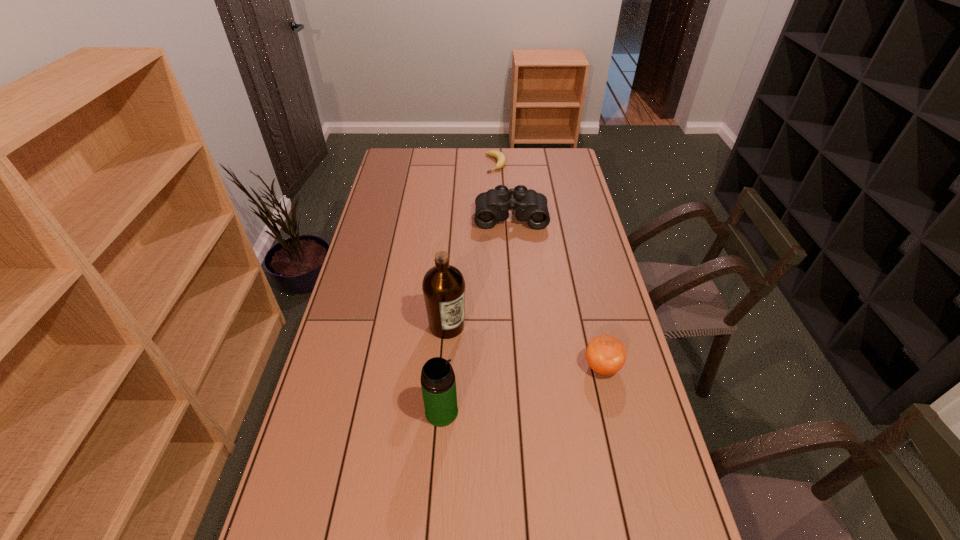
At what (x,y) coordinates should I click in order to perform the action: click on the fourth shortest object. Please return your answer as a coordinate pair (x, y). This screenshot has width=960, height=540. Looking at the image, I should click on (438, 383).

This screenshot has height=540, width=960. I want to click on thermos bottle, so click(438, 383).

Find the location of a particular element. This screenshot has height=540, width=960. the rightmost object is located at coordinates (605, 354).

The height and width of the screenshot is (540, 960). What are the coordinates of `the fourth farthest object` in the screenshot? It's located at (605, 354).

Locate an element on the screen. This screenshot has width=960, height=540. the third nearest object is located at coordinates (443, 286).

Identify the location of the tallest object. (443, 286).

At what (x,y) coordinates should I click in order to perform the action: click on the farthest object. Please return your answer as a coordinate pair (x, y). This screenshot has width=960, height=540. Looking at the image, I should click on (498, 155).

Where is `banana`? banana is located at coordinates (498, 155).

Image resolution: width=960 pixels, height=540 pixels. Find the location of `binoculars`. binoculars is located at coordinates (494, 205).

The height and width of the screenshot is (540, 960). What are the coordinates of `vacant position located from the spout of the second tallest object` in the screenshot? It's located at (514, 412).